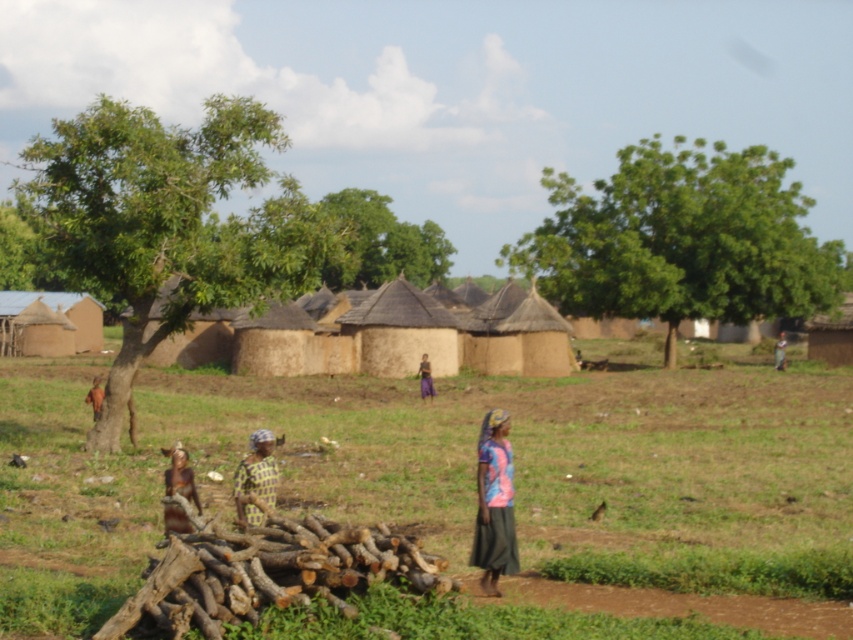
Between printed fabric headscarf at center and light brown wooden stick at center, which one has more height?

Standing taller between the two is light brown wooden stick at center.

Can you confirm if printed fabric headscarf at center is shorter than light brown wooden stick at center?

Correct, printed fabric headscarf at center is not as tall as light brown wooden stick at center.

Describe the element at coordinates (256, 477) in the screenshot. I see `printed fabric headscarf at center` at that location.

Image resolution: width=853 pixels, height=640 pixels. Find the location of `printed fabric headscarf at center`. printed fabric headscarf at center is located at coordinates (256, 477).

Measure the distance between brown thatched hut at left and camera.

brown thatched hut at left is 82.85 meters from camera.

Between point (7, 308) and point (96, 387), which one is positioned in front?

Point (96, 387) is in front.

The width and height of the screenshot is (853, 640). What do you see at coordinates (50, 323) in the screenshot?
I see `brown thatched hut at left` at bounding box center [50, 323].

The height and width of the screenshot is (640, 853). Find the location of `brown thatched hut at left`. brown thatched hut at left is located at coordinates (50, 323).

Who is positioned more to the left, brown thatched hut at left or light brown wooden stick at center?

brown thatched hut at left

Who is higher up, brown thatched hut at left or light brown wooden stick at center?

brown thatched hut at left

Find the location of a particular element. The image size is (853, 640). brown thatched hut at left is located at coordinates (50, 323).